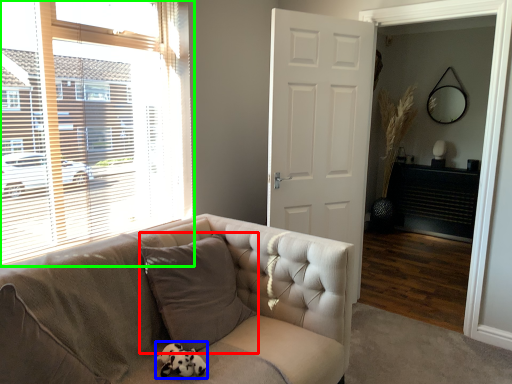
Question: Considering the real-world distances, which object is farthest from pillow (highlighted by a red box)? animal (highlighted by a blue box) or window (highlighted by a green box)?

Choices:
 (A) animal
 (B) window

Answer: (B)